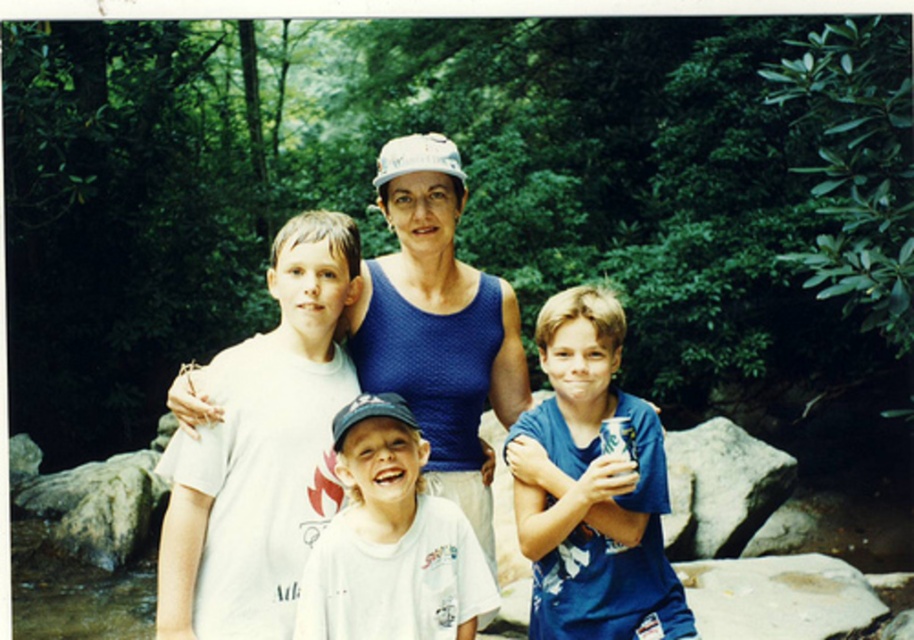
Question: From the image, what is the correct spatial relationship of white cotton t-shirt at center in relation to white cotton shirt at center?

Choices:
 (A) left
 (B) right

Answer: (A)

Question: Which point appears farthest from the camera in this image?

Choices:
 (A) (298, 352)
 (B) (386, 593)

Answer: (A)

Question: Does blue mesh tank top at center have a lesser width compared to gray rock at right?

Choices:
 (A) no
 (B) yes

Answer: (B)

Question: Which object appears closest to the camera in this image?

Choices:
 (A) gray rock at right
 (B) white cotton t-shirt at center
 (C) blue cotton shirt at center
 (D) blue mesh tank top at center

Answer: (C)

Question: Observing the image, what is the correct spatial positioning of blue mesh tank top at center in reference to gray rock at right?

Choices:
 (A) right
 (B) left

Answer: (B)

Question: Which point is closer to the camera?

Choices:
 (A) (253, 413)
 (B) (564, 563)

Answer: (A)